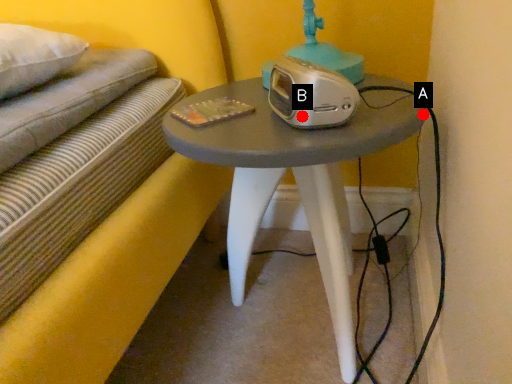
Question: Two points are circled on the image, labeled by A and B beside each circle. Which point is closer to the camera taking this photo?

Choices:
 (A) A is closer
 (B) B is closer

Answer: (B)